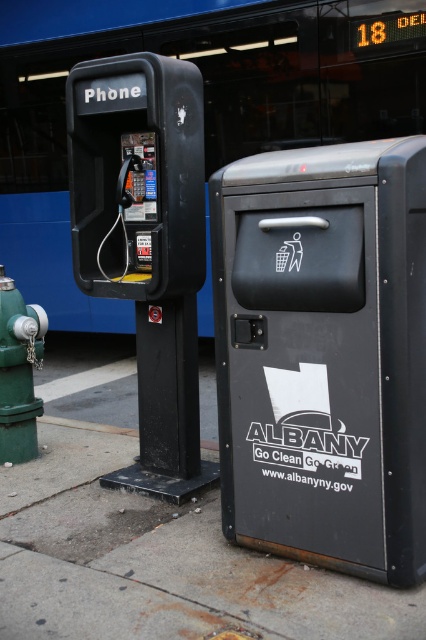
Question: Based on their relative distances, which object is farther from the matte black phone at left?

Choices:
 (A) green matte hydrant at lower left
 (B) matte black mailbox at center

Answer: (A)

Question: Is matte black mailbox at center further to the viewer compared to concrete sidewalk at lower center?

Choices:
 (A) no
 (B) yes

Answer: (B)

Question: Which object is closer to the camera taking this photo?

Choices:
 (A) green matte hydrant at lower left
 (B) concrete sidewalk at lower center

Answer: (B)

Question: Observing the image, what is the correct spatial positioning of concrete sidewalk at lower center in reference to matte black phone at left?

Choices:
 (A) below
 (B) above

Answer: (A)

Question: Which of the following is the farthest from the observer?

Choices:
 (A) (16, 324)
 (B) (167, 480)
 (C) (420, 419)

Answer: (A)

Question: Is matte black mailbox at center to the left of matte black phone at left from the viewer's perspective?

Choices:
 (A) no
 (B) yes

Answer: (A)